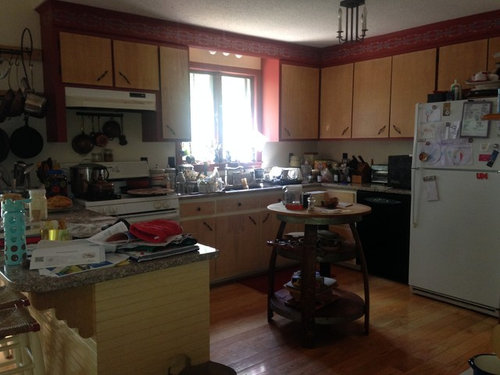
Where is `top of counter`? The image size is (500, 375). top of counter is located at coordinates (127, 272).